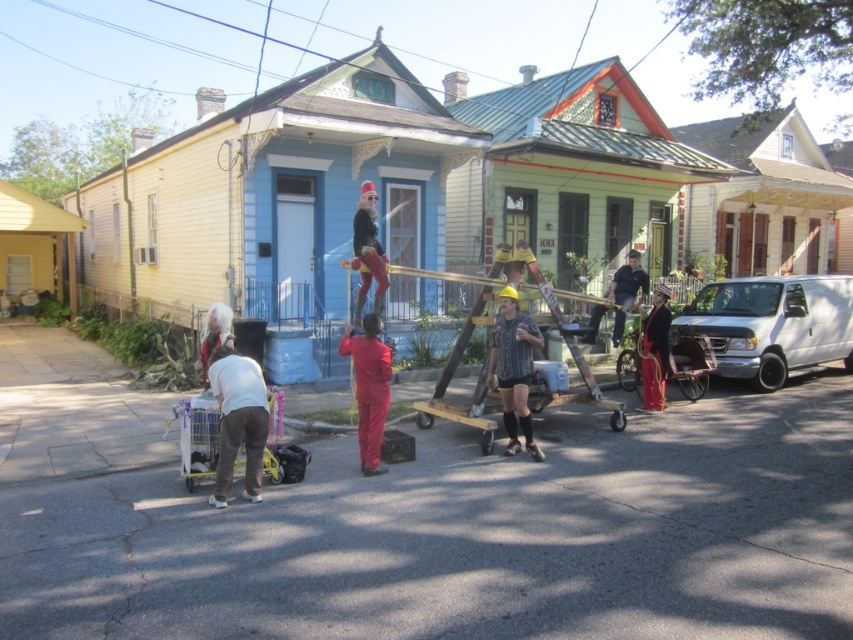
You are standing in the street scene and want to reach a point that is exactly 8.78 meters away from your current position. You see the point labeled as point (486, 285) in the image. Can you confirm if this point is exactly the distance you need?

Yes, the point (486, 285) is exactly 8.78 meters away from the viewer, so it matches the required distance.

From the picture: You are a delivery person trying to deliver a package to the house on the left. You see a wooden at center and dark blue jeans at center in the way. Which object should you move first to clear the path?

The wooden at center is in front of dark blue jeans at center, so you should move the wooden at center first to clear the path.

You are standing in the street scene and see the wooden at center and the dark blue jeans at center. Which object is taller?

The wooden at center is much taller than the dark blue jeans at center.